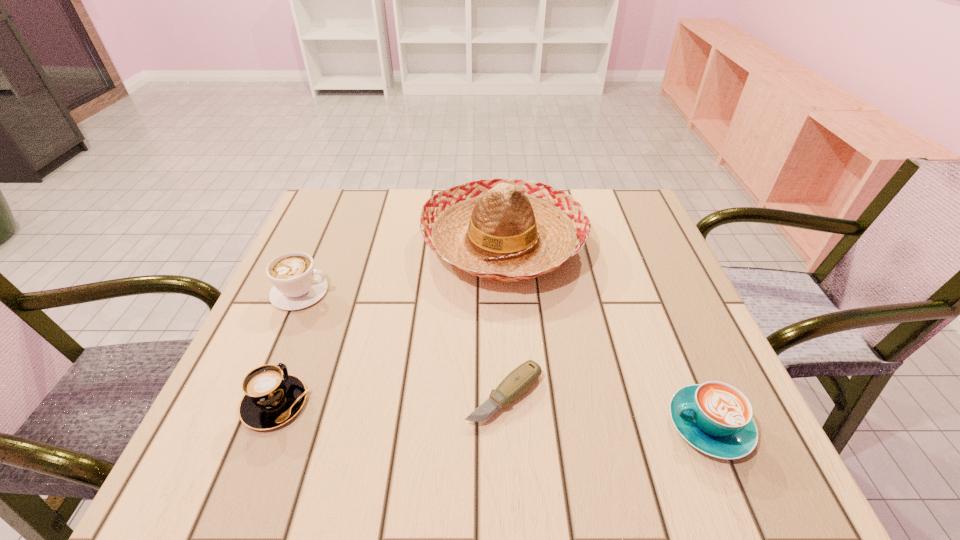
Where is `object at the far edge`? Image resolution: width=960 pixels, height=540 pixels. object at the far edge is located at coordinates (508, 230).

Image resolution: width=960 pixels, height=540 pixels. I want to click on object positioned at the right edge, so click(716, 418).

Where is `object that is at the near left corner`? This screenshot has width=960, height=540. object that is at the near left corner is located at coordinates (272, 398).

Find the location of a particular element. object positioned at the near right corner is located at coordinates (716, 418).

Find the location of `vacant region at the near edge`. vacant region at the near edge is located at coordinates (471, 475).

The image size is (960, 540). In the image, there is a desktop. What are the coordinates of `vacant space at the right edge` in the screenshot? It's located at (684, 306).

In the image, there is a desktop. Where is `vacant space at the far left corner`? This screenshot has width=960, height=540. vacant space at the far left corner is located at coordinates (372, 204).

Find the location of a particular element. free space at the near left corner of the desktop is located at coordinates (250, 457).

In the image, there is a desktop. Where is `free space at the far right corner`? This screenshot has width=960, height=540. free space at the far right corner is located at coordinates (589, 214).

Image resolution: width=960 pixels, height=540 pixels. I want to click on blank region between the farthest cappuccino and the tallest object, so click(x=402, y=267).